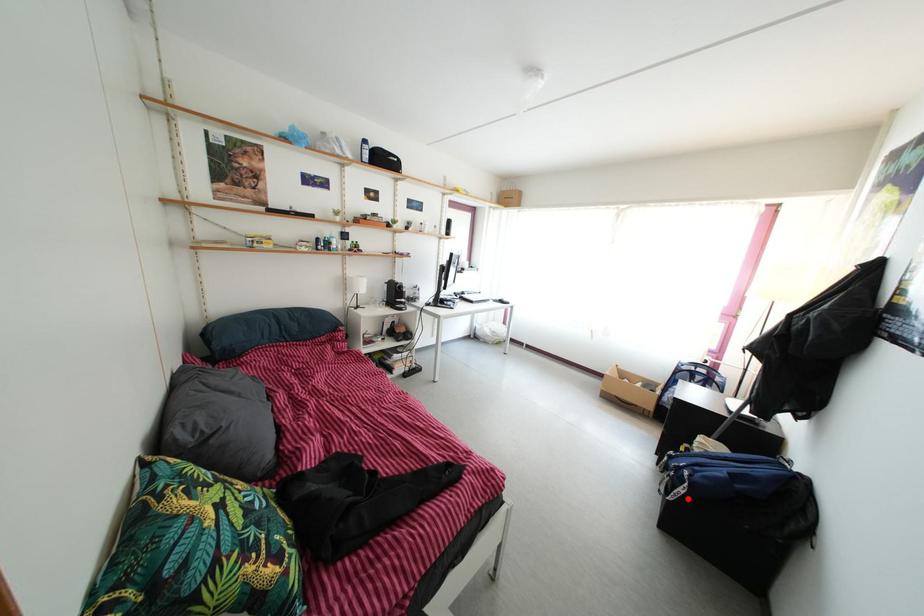
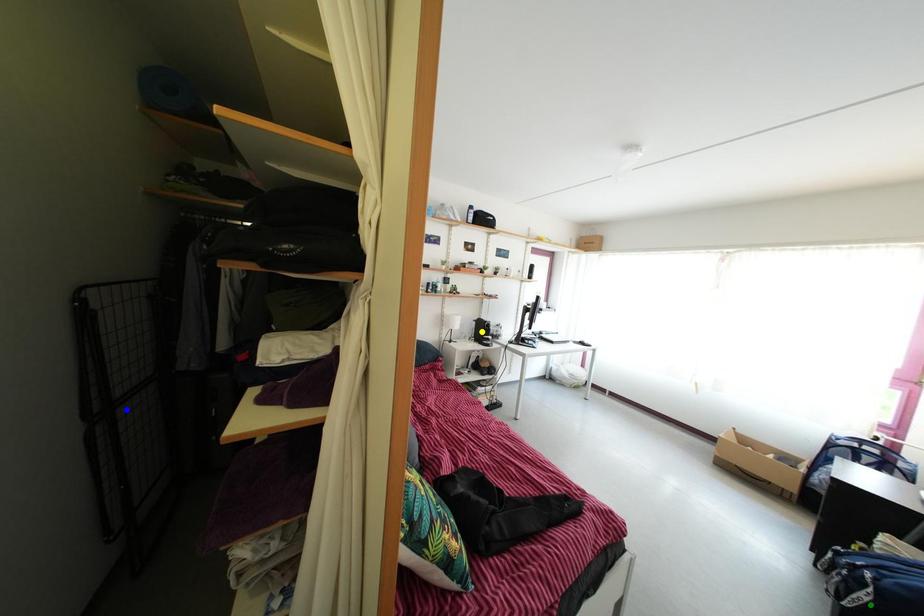
Question: I am providing you with two images of the same scene from different viewpoints. A red point is marked on the first image. You are given multiple points on the second image. Which point in image 2 is actually the same real-world point as the red point in image 1?

Choices:
 (A) blue point
 (B) green point
 (C) yellow point

Answer: (B)